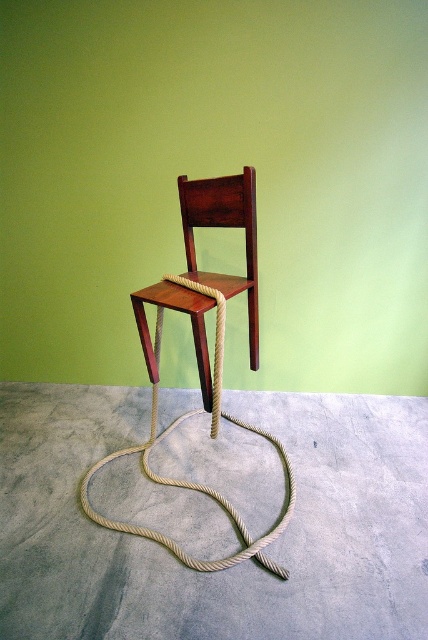
Between mahogany wood chair at center and wooden chair at center, which one is positioned lower?

wooden chair at center

Locate an element on the screen. This screenshot has height=640, width=428. mahogany wood chair at center is located at coordinates (223, 227).

The height and width of the screenshot is (640, 428). In order to click on mahogany wood chair at center in this screenshot , I will do `click(223, 227)`.

Locate an element on the screen. mahogany wood chair at center is located at coordinates (223, 227).

Is mahogany wood chair at center smaller than natural beige rope at center?

Yes.

At what (x,y) coordinates should I click in order to perform the action: click on mahogany wood chair at center. Please return your answer as a coordinate pair (x, y). The image size is (428, 640). Looking at the image, I should click on (223, 227).

This screenshot has width=428, height=640. I want to click on mahogany wood chair at center, so click(x=223, y=227).

Between natural beige rope at center and wooden chair at center, which one has less height?

Standing shorter between the two is wooden chair at center.

Does natural beige rope at center have a greater width compared to wooden chair at center?

Correct, the width of natural beige rope at center exceeds that of wooden chair at center.

Is point (136, 445) closer to camera compared to point (219, 408)?

No, (136, 445) is behind (219, 408).

The height and width of the screenshot is (640, 428). I want to click on natural beige rope at center, so click(196, 483).